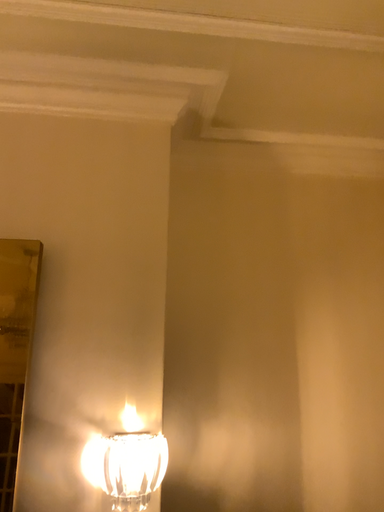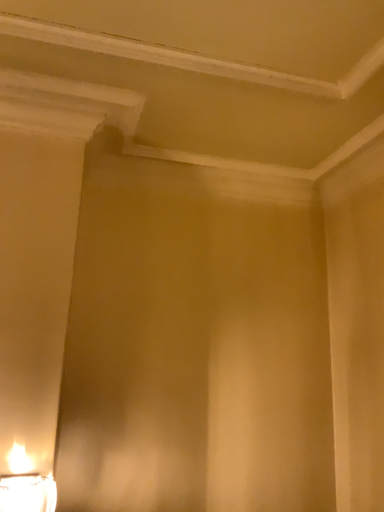
Question: How did the camera likely rotate when shooting the video?

Choices:
 (A) rotated left
 (B) rotated right

Answer: (B)